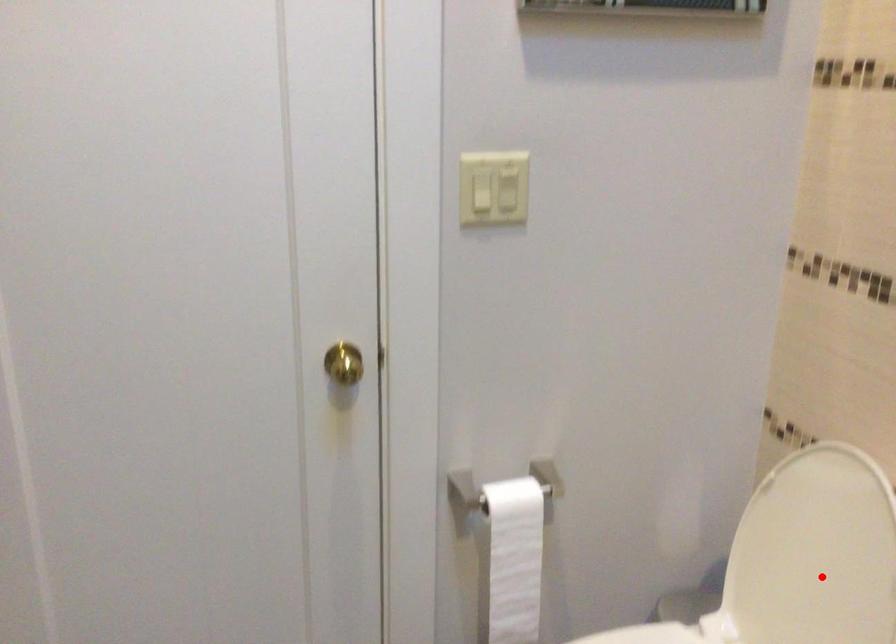
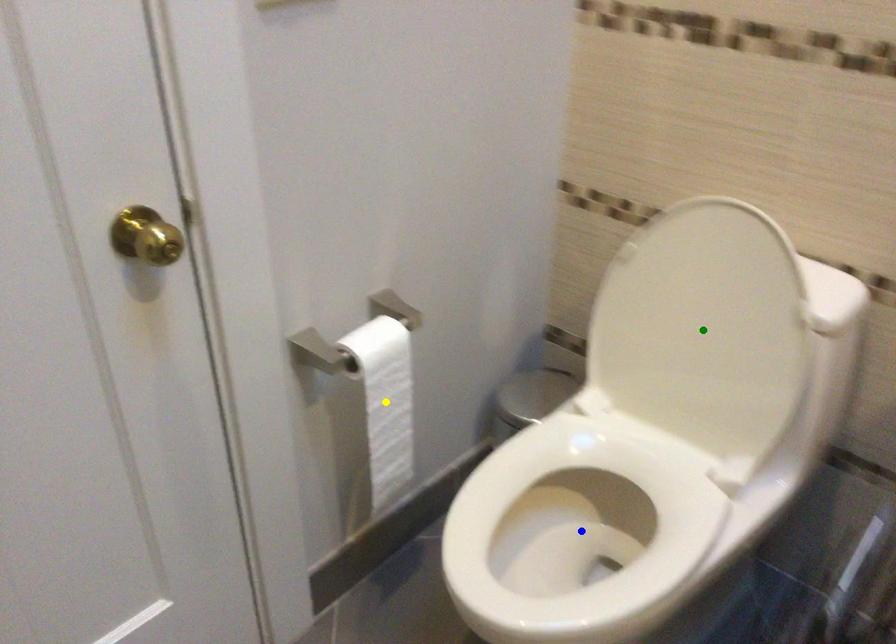
Question: I am providing you with two images of the same scene from different viewpoints. A red point is marked on the first image. You are given multiple points on the second image. In image 2, which mark is for the same physical point as the one in image 1?

Choices:
 (A) green point
 (B) blue point
 (C) yellow point

Answer: (A)